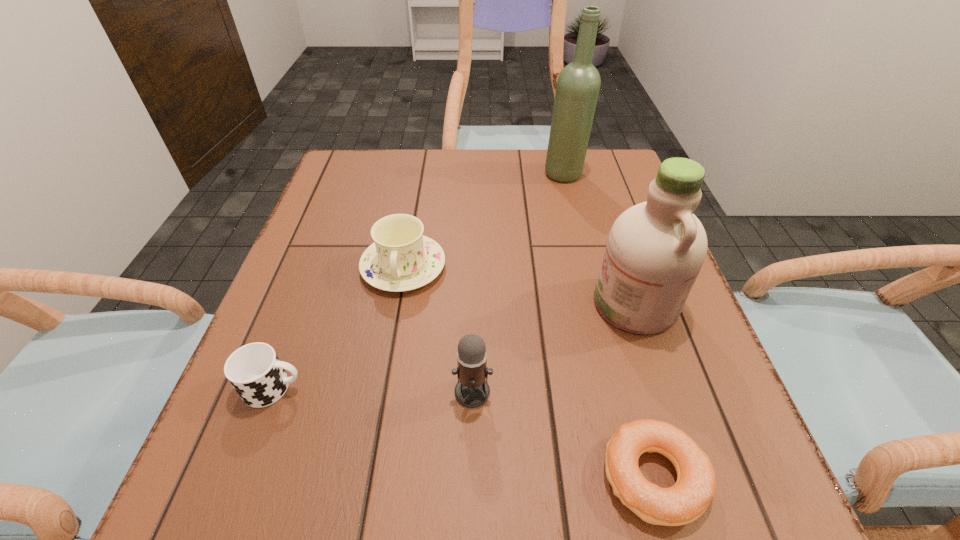
Identify the location of free space between the second tallest object and the second object from left to right. (519, 285).

Where is `vacant point located between the farthest object and the cleansing agent`? Image resolution: width=960 pixels, height=540 pixels. vacant point located between the farthest object and the cleansing agent is located at coordinates (599, 239).

You are a GUI agent. You are given a task and a screenshot of the screen. Output one action in this format:
    pyautogui.click(x=<x>, y=<y>)
    Task: Click on the unoccupied position between the cup and the chinaware
    This screenshot has height=540, width=960.
    Given the screenshot: What is the action you would take?
    pyautogui.click(x=339, y=327)

Find the location of a particular element. The height and width of the screenshot is (540, 960). object identified as the closest to the wine bottle is located at coordinates (401, 259).

Identify the location of object that is the second nearest to the fourth object from right to left. This screenshot has height=540, width=960. (401, 259).

Locate an element on the screen. The width and height of the screenshot is (960, 540). vacant region that satisfies the following two spatial constraints: 1. on the side of the leftmost object with the handle; 2. on the left side of the third tallest object is located at coordinates (273, 392).

This screenshot has height=540, width=960. Find the location of `free space that satisfies the following two spatial constraints: 1. on the back side of the microphone; 2. on the side of the cup with the handle`. free space that satisfies the following two spatial constraints: 1. on the back side of the microphone; 2. on the side of the cup with the handle is located at coordinates (473, 388).

Find the location of `free space that satisfies the following two spatial constraints: 1. on the handle side of the microphone; 2. on the right side of the chinaware`. free space that satisfies the following two spatial constraints: 1. on the handle side of the microphone; 2. on the right side of the chinaware is located at coordinates (381, 392).

At what (x,y) coordinates should I click in order to perform the action: click on vacant space that satisfies the following two spatial constraints: 1. on the side of the cup with the handle; 2. on the left side of the microphone. Please return your answer as a coordinate pair (x, y). The height and width of the screenshot is (540, 960). Looking at the image, I should click on (273, 392).

You are a GUI agent. You are given a task and a screenshot of the screen. Output one action in this format:
    pyautogui.click(x=<x>, y=<y>)
    Task: Click on the blank space that satisfies the following two spatial constraints: 1. on the side of the third object from left to right with the handle; 2. on the right side of the fifth tallest object
    The image size is (960, 540).
    Given the screenshot: What is the action you would take?
    pyautogui.click(x=273, y=392)